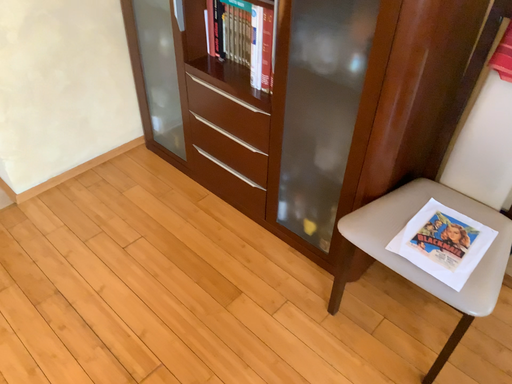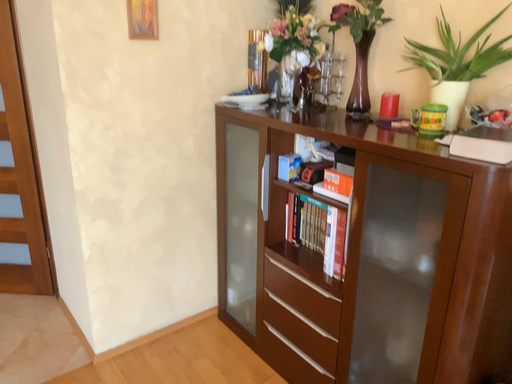
Question: How did the camera likely rotate when shooting the video?

Choices:
 (A) rotated right
 (B) rotated left

Answer: (B)